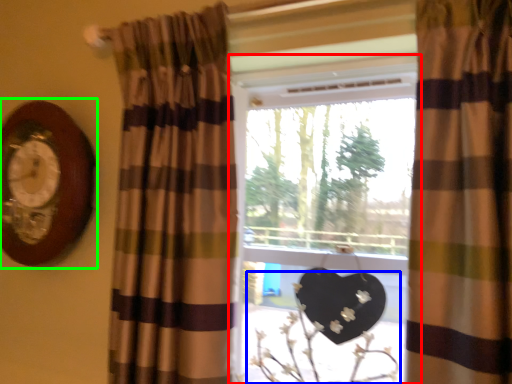
Question: Based on their relative distances, which object is farther from window (highlighted by a red box)? Choose from floral arrangement (highlighted by a blue box) and clock (highlighted by a green box).

Choices:
 (A) floral arrangement
 (B) clock

Answer: (B)